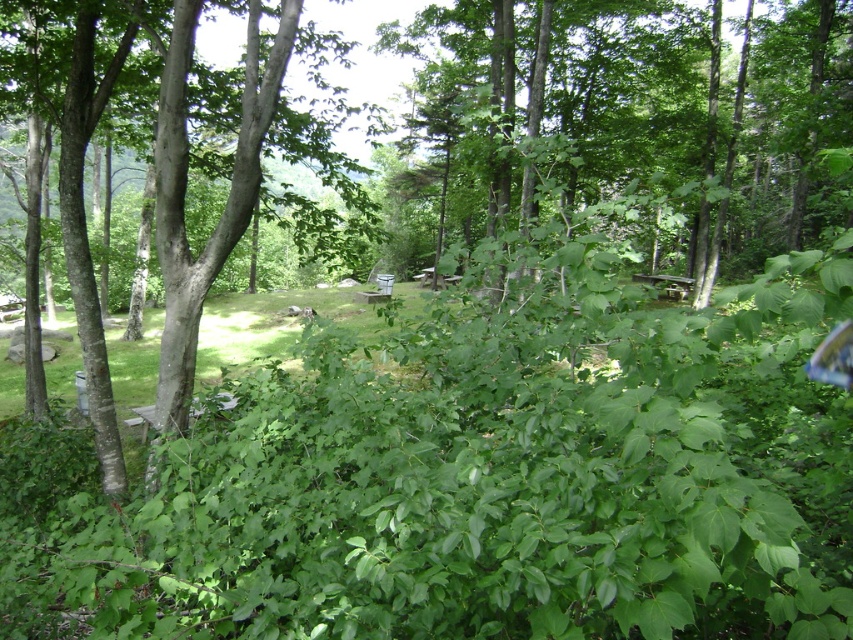
Does green leafy tree at center appear under smooth bark tree at center?

Actually, green leafy tree at center is above smooth bark tree at center.

In order to click on green leafy tree at center in this screenshot , I will do `click(664, 108)`.

I want to click on green leafy tree at center, so click(664, 108).